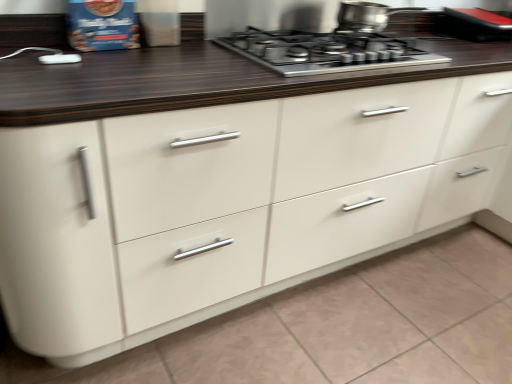
Question: Is black rubberized phone at upper right not inside stainless steel gas stove at upper center?

Choices:
 (A) yes
 (B) no

Answer: (A)

Question: Is black rubberized phone at upper right not close to stainless steel gas stove at upper center?

Choices:
 (A) no
 (B) yes

Answer: (A)

Question: Can you confirm if black rubberized phone at upper right is smaller than stainless steel gas stove at upper center?

Choices:
 (A) yes
 (B) no

Answer: (A)

Question: Is black rubberized phone at upper right closer to camera compared to stainless steel gas stove at upper center?

Choices:
 (A) yes
 (B) no

Answer: (B)

Question: Is black rubberized phone at upper right further to camera compared to stainless steel gas stove at upper center?

Choices:
 (A) yes
 (B) no

Answer: (A)

Question: Is the surface of black rubberized phone at upper right in direct contact with stainless steel gas stove at upper center?

Choices:
 (A) yes
 (B) no

Answer: (B)

Question: From a real-world perspective, is stainless steel gas stove at upper center over stainless steel pot at upper center?

Choices:
 (A) no
 (B) yes

Answer: (A)

Question: Is stainless steel pot at upper center at the back of stainless steel gas stove at upper center?

Choices:
 (A) no
 (B) yes

Answer: (A)

Question: Is stainless steel gas stove at upper center in front of stainless steel pot at upper center?

Choices:
 (A) no
 (B) yes

Answer: (B)

Question: Is stainless steel gas stove at upper center not inside stainless steel pot at upper center?

Choices:
 (A) no
 (B) yes

Answer: (B)

Question: Is stainless steel gas stove at upper center with stainless steel pot at upper center?

Choices:
 (A) no
 (B) yes

Answer: (A)

Question: Would you say stainless steel gas stove at upper center contains stainless steel pot at upper center?

Choices:
 (A) yes
 (B) no

Answer: (B)

Question: Does stainless steel pot at upper center come in front of black rubberized phone at upper right?

Choices:
 (A) no
 (B) yes

Answer: (B)